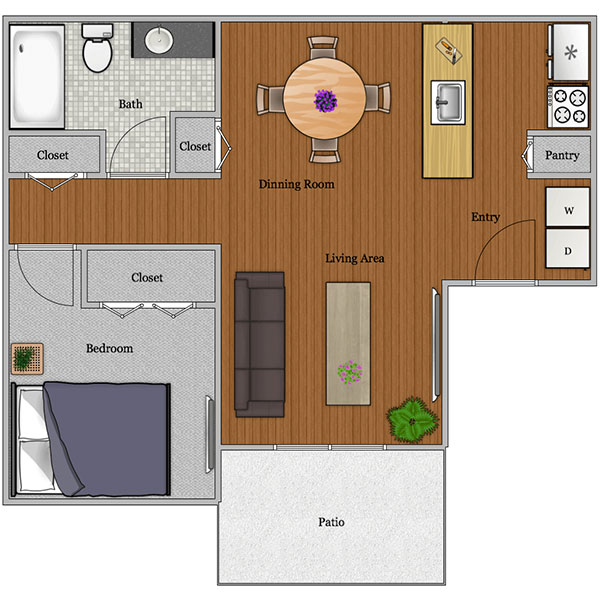
Identify the location of plant. (411, 427), (26, 357).